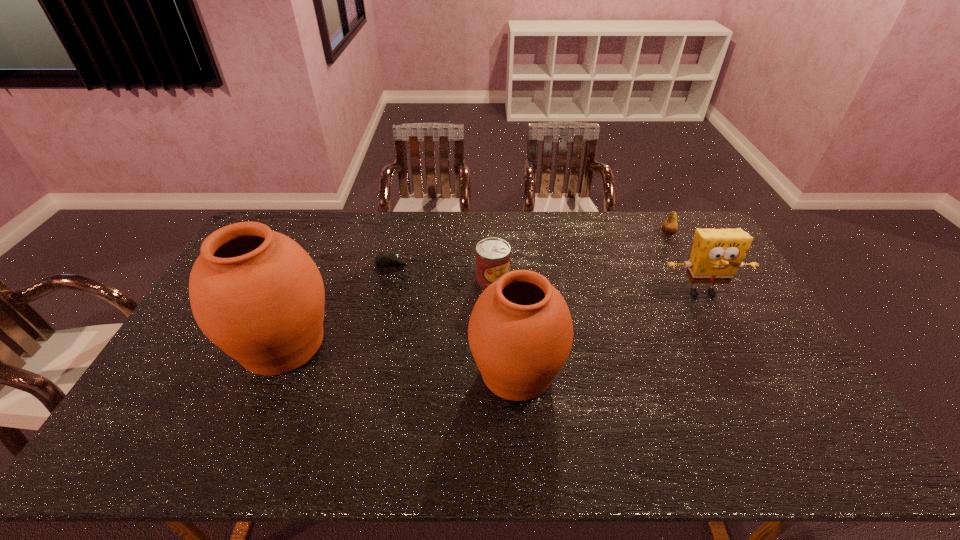
Locate an element on the screen. Image resolution: width=960 pixels, height=540 pixels. free point between the shortest object and the can is located at coordinates (442, 271).

Identify the location of vacant space in between the can and the leftmost object. (388, 312).

The height and width of the screenshot is (540, 960). I want to click on free space between the tallest object and the computer equipment, so click(x=337, y=303).

Find the location of a particular element. The image size is (960, 540). free spot between the right urn and the sponge is located at coordinates (610, 332).

This screenshot has height=540, width=960. What are the coordinates of `free space between the sponge and the second farthest object` in the screenshot? It's located at (546, 278).

Locate which object ranks in proximity to the farthest object. Please provide its 2D coordinates. Your answer should be formatted as a tuple, i.e. [(x, y)], where the tuple contains the x and y coordinates of a point satisfying the conditions above.

[(717, 254)]

The height and width of the screenshot is (540, 960). In order to click on the third closest object to the can in this screenshot , I will do `click(255, 293)`.

This screenshot has width=960, height=540. Identify the location of vacant point that satisfies the following two spatial constraints: 1. on the back side of the left urn; 2. on the left side of the can. (310, 280).

Find the location of a particular element. The width and height of the screenshot is (960, 540). free region that satisfies the following two spatial constraints: 1. on the front side of the farthest object; 2. on the button of the second farthest object is located at coordinates (684, 262).

This screenshot has width=960, height=540. Identify the location of blank area in the image that satisfies the following two spatial constraints: 1. on the back side of the fifth shortest object; 2. on the button of the computer equipment. (509, 262).